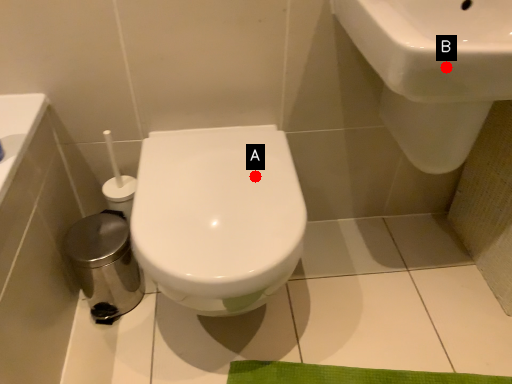
Question: Two points are circled on the image, labeled by A and B beside each circle. Which point is farther from the camera taking this photo?

Choices:
 (A) A is further
 (B) B is further

Answer: (A)